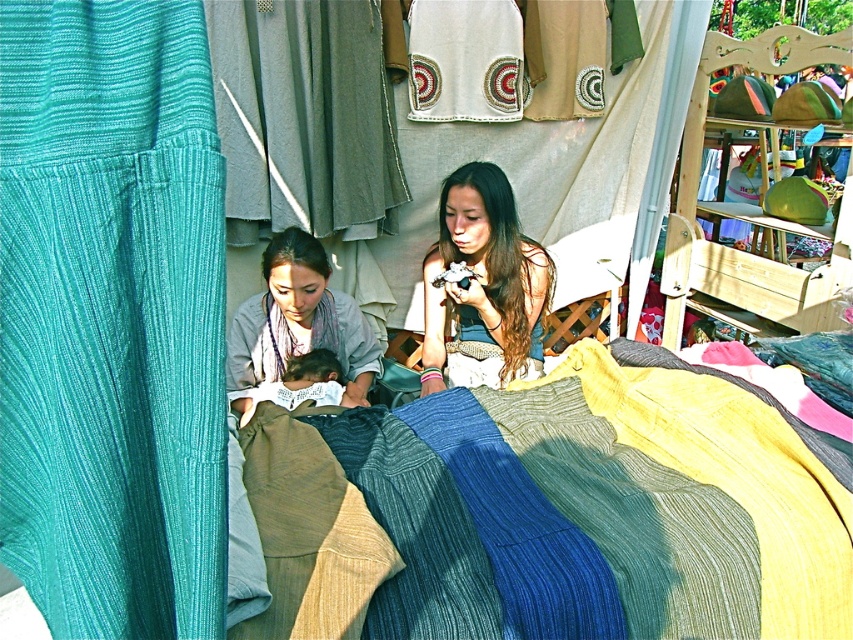
Question: Is matte blue dress at center wider than soft white fabric at center?

Choices:
 (A) yes
 (B) no

Answer: (A)

Question: Does ribbed wool blanket at center have a lesser width compared to matte gray scarf at center?

Choices:
 (A) no
 (B) yes

Answer: (A)

Question: Which point is farther from the camera taking this photo?

Choices:
 (A) (61, 280)
 (B) (482, 186)

Answer: (B)

Question: Can you confirm if ribbed wool blanket at center is positioned to the right of matte blue dress at center?

Choices:
 (A) yes
 (B) no

Answer: (A)

Question: Which of these objects is positioned closest to the ribbed wool blanket at center?

Choices:
 (A) soft white fabric at center
 (B) teal ribbed fabric at left
 (C) matte blue dress at center
 (D) matte gray scarf at center

Answer: (B)

Question: Estimate the real-world distances between objects in this image. Which object is closer to the matte blue dress at center?

Choices:
 (A) ribbed wool blanket at center
 (B) soft white fabric at center
 (C) teal ribbed fabric at left

Answer: (B)